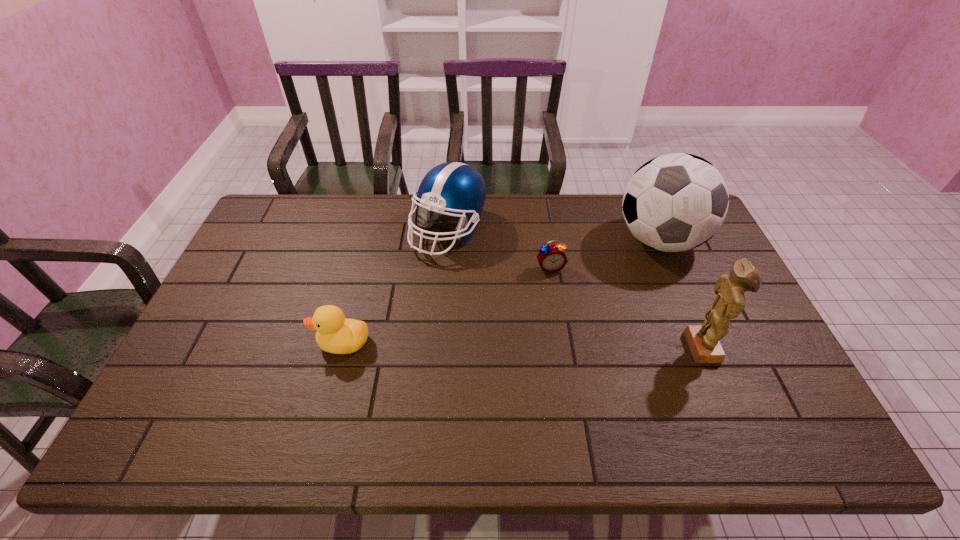
You are a GUI agent. You are given a task and a screenshot of the screen. Output one action in this format:
    pyautogui.click(x=<x>, y=<y>)
    Task: Click on the free space that is in between the soccer ball and the duck
    The height and width of the screenshot is (540, 960).
    Given the screenshot: What is the action you would take?
    pyautogui.click(x=501, y=291)

Locate an element on the screen. Image resolution: width=960 pixels, height=540 pixels. vacant point located between the leftmost object and the soccer ball is located at coordinates (501, 291).

Identify the location of vacant space that is in between the third object from left to right and the soccer ball. (605, 254).

Find the location of `vacant area that lies between the third object from left to right and the figurine`. vacant area that lies between the third object from left to right and the figurine is located at coordinates (628, 307).

At what (x,y) coordinates should I click in order to perform the action: click on free space between the third tallest object and the alarm clock. Please return your answer as a coordinate pair (x, y). This screenshot has width=960, height=540. Looking at the image, I should click on (499, 249).

The image size is (960, 540). Identify the location of unoccupied position between the third object from right to left and the duck. (446, 305).

Find the location of a particular element. blank region between the figurine and the soccer ball is located at coordinates (682, 294).

What are the coordinates of `vacant area that lies between the duck and the soccer ball` in the screenshot? It's located at (501, 291).

Image resolution: width=960 pixels, height=540 pixels. In order to click on vacant area that lies between the alarm clock and the leftmost object in this screenshot , I will do `click(446, 305)`.

This screenshot has width=960, height=540. What are the coordinates of `free space between the soccer ball and the figurine` in the screenshot? It's located at (682, 294).